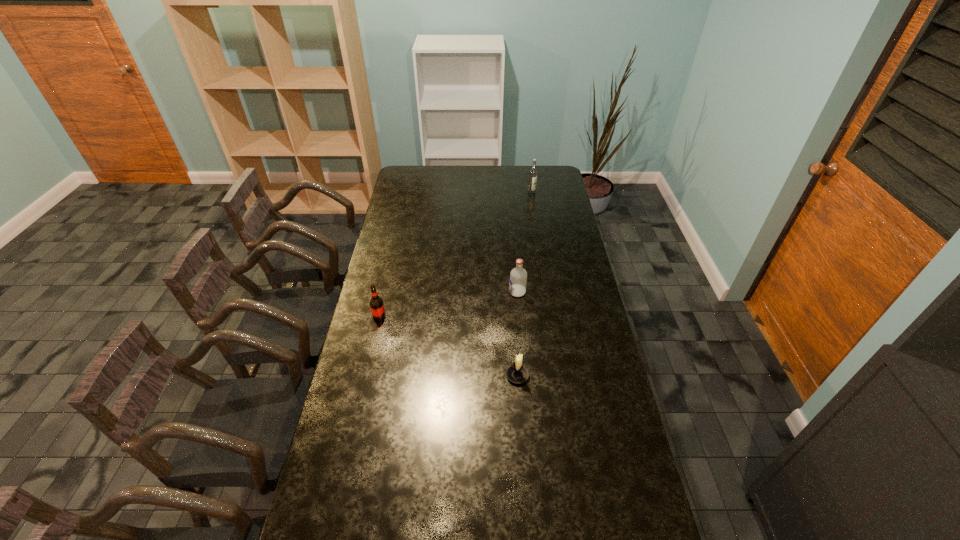
The height and width of the screenshot is (540, 960). What are the coordinates of `the rightmost object` in the screenshot? It's located at (533, 172).

You are a GUI agent. You are given a task and a screenshot of the screen. Output one action in this format:
    pyautogui.click(x=<x>, y=<y>)
    Task: Click on the farther vodka
    The height and width of the screenshot is (540, 960).
    Given the screenshot: What is the action you would take?
    pyautogui.click(x=533, y=172)

This screenshot has height=540, width=960. Find the location of `the left vodka`. the left vodka is located at coordinates (518, 276).

At what (x,y) coordinates should I click in order to perform the action: click on the nearer vodka. Please return your answer as a coordinate pair (x, y). Looking at the image, I should click on (518, 276).

Find the location of a particular element. Image resolution: width=960 pixels, height=540 pixels. root beer is located at coordinates (376, 304).

Identify the location of the leftmost object. (376, 304).

This screenshot has height=540, width=960. I want to click on the shortest object, so click(517, 373).

Locate an element on the screen. candle holder is located at coordinates (517, 373).

This screenshot has height=540, width=960. I want to click on vacant space situated 0.170m on the label of the rightmost object, so click(x=535, y=212).

I want to click on vacant space located on the label of the nearer vodka, so click(448, 292).